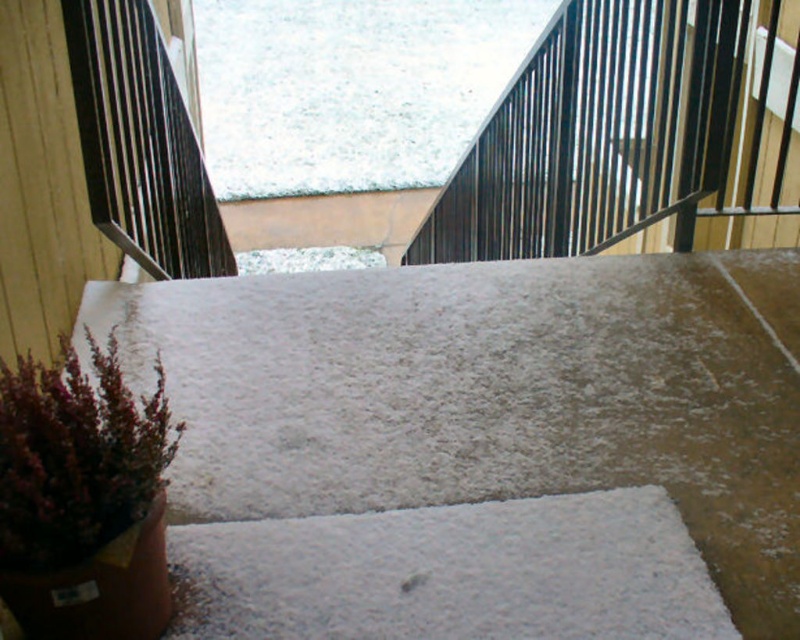
Who is positioned more to the right, white textured ramp at lower left or white textured carpet at center?

white textured ramp at lower left is more to the right.

Is white textured ramp at lower left behind white textured carpet at center?

Yes, white textured ramp at lower left is behind white textured carpet at center.

Between point (692, 516) and point (290, 566), which one is positioned in front?

Point (290, 566)

Identify the location of white textured ramp at lower left. The width and height of the screenshot is (800, 640). (490, 394).

Does white textured ramp at lower left have a greater height compared to black metal rail at upper center?

Incorrect, white textured ramp at lower left's height is not larger of black metal rail at upper center's.

Between white textured ramp at lower left and black metal rail at upper center, which one appears on the left side from the viewer's perspective?

white textured ramp at lower left is more to the left.

Describe the element at coordinates (490, 394) in the screenshot. This screenshot has width=800, height=640. I see `white textured ramp at lower left` at that location.

Find the location of a particular element. This screenshot has width=800, height=640. white textured ramp at lower left is located at coordinates (490, 394).

Is white fluffy snow at upper center taller than purple matte plant at lower left?

Indeed, white fluffy snow at upper center has a greater height compared to purple matte plant at lower left.

Which is behind, point (450, 163) or point (158, 369)?

Positioned behind is point (450, 163).

Identify the location of white fluffy snow at upper center. (352, 88).